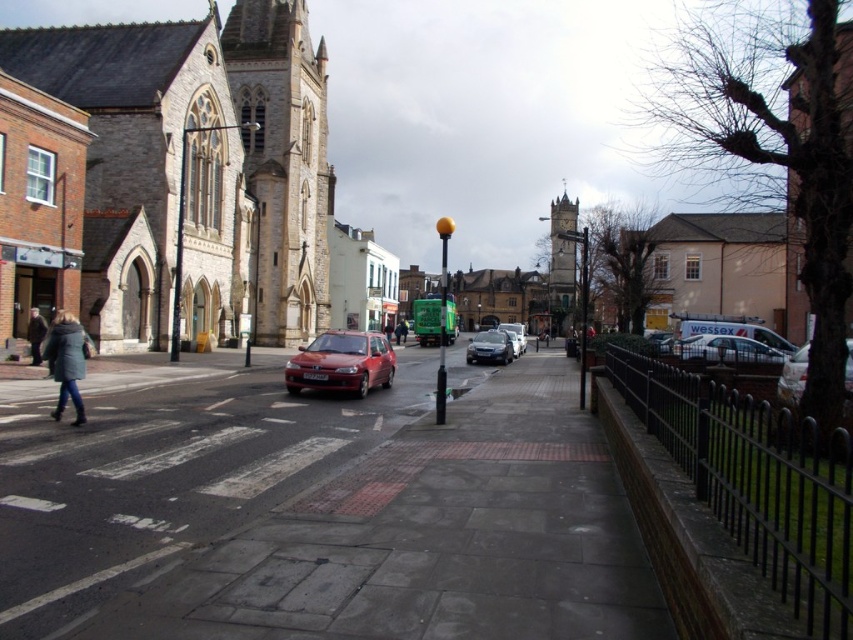
Question: Which point is closer to the camera?

Choices:
 (A) (785, 387)
 (B) (793, 211)
 (C) (164, 548)
 (D) (30, 339)

Answer: (C)

Question: Is metallic silver van at right wider than satin silver sedan at center?

Choices:
 (A) yes
 (B) no

Answer: (B)

Question: Which point is farther to the camera?

Choices:
 (A) smooth brown church at right
 (B) white metallic van at center-right
 (C) white matte building at center

Answer: (C)

Question: Does white matte building at center have a larger size compared to smooth brown church at right?

Choices:
 (A) yes
 (B) no

Answer: (A)

Question: Considering the relative positions of dark green coat at left and satin silver sedan at center in the image provided, where is dark green coat at left located with respect to satin silver sedan at center?

Choices:
 (A) left
 (B) right

Answer: (A)

Question: Among these points, which one is nearest to the camera?

Choices:
 (A) (840, 243)
 (B) (38, 352)
 (C) (322, 369)
 (D) (76, 378)

Answer: (A)